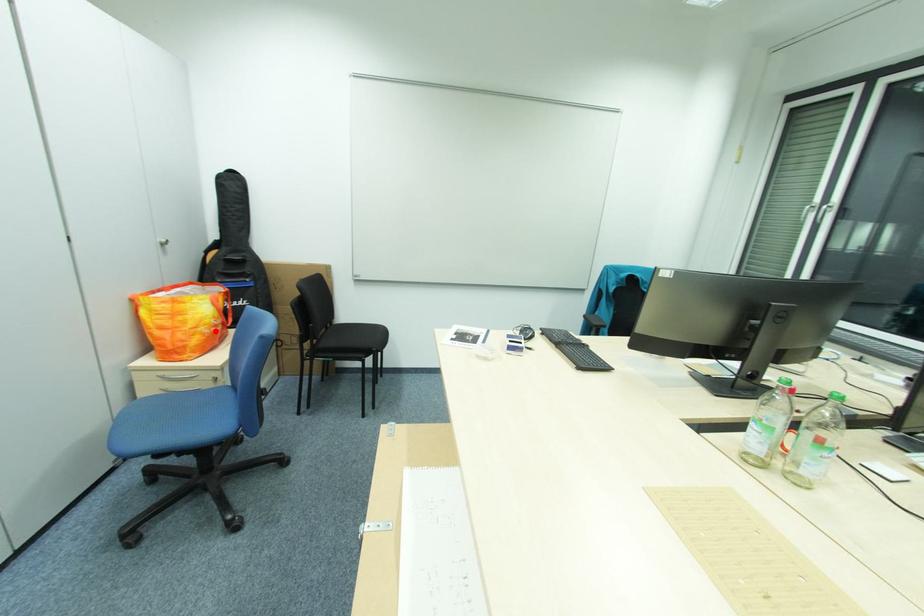
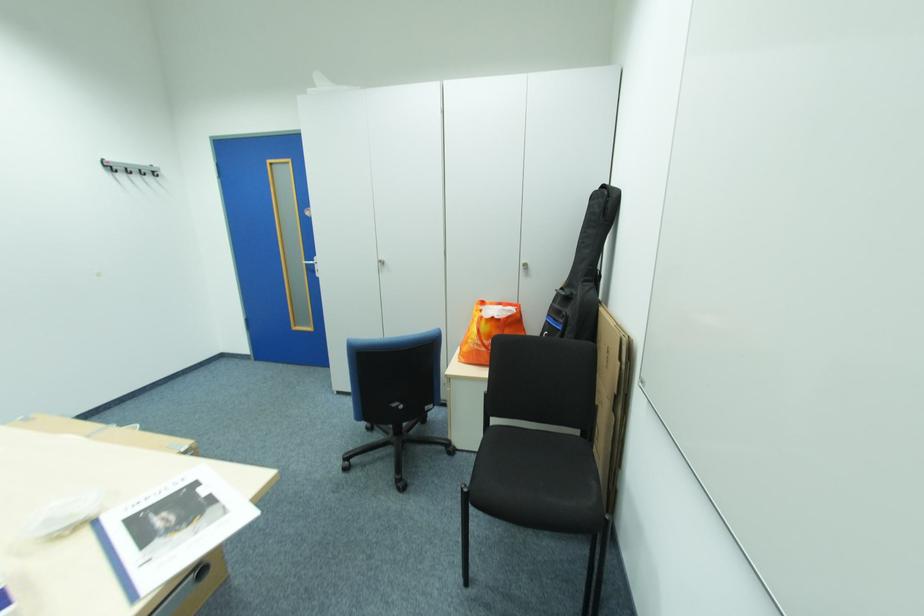
In the second image, find the point that corresponds to the highlighted location in the first image.

(480, 345)